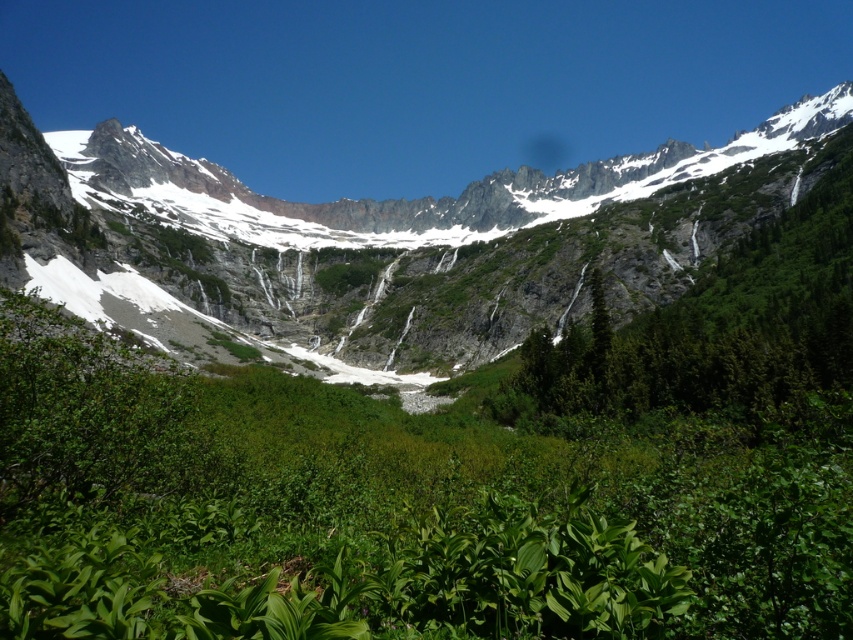
Question: Which point appears closest to the camera in this image?

Choices:
 (A) (769, 122)
 (B) (697, 385)

Answer: (B)

Question: Can you confirm if green mossy rock at center is wider than green leafy tree at upper right?

Choices:
 (A) no
 (B) yes

Answer: (B)

Question: Does green mossy rock at center have a larger size compared to green leafy tree at upper right?

Choices:
 (A) yes
 (B) no

Answer: (A)

Question: Can you confirm if green mossy rock at center is thinner than green leafy tree at upper right?

Choices:
 (A) yes
 (B) no

Answer: (B)